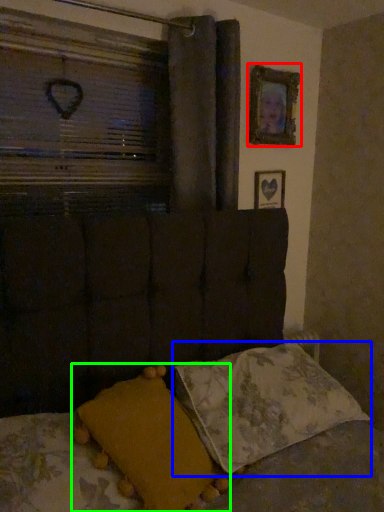
Question: Considering the real-world distances, which object is closest to picture frame (highlighted by a red box)? pillow (highlighted by a blue box) or pillow (highlighted by a green box).

Choices:
 (A) pillow
 (B) pillow

Answer: (A)